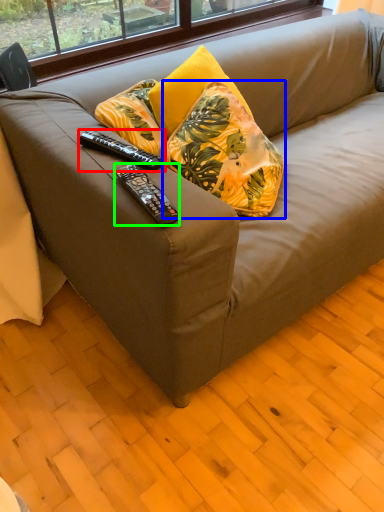
Question: Which is nearer to the remote control (highlighted by a red box)? pillow (highlighted by a blue box) or remote control (highlighted by a green box).

Choices:
 (A) pillow
 (B) remote control

Answer: (B)